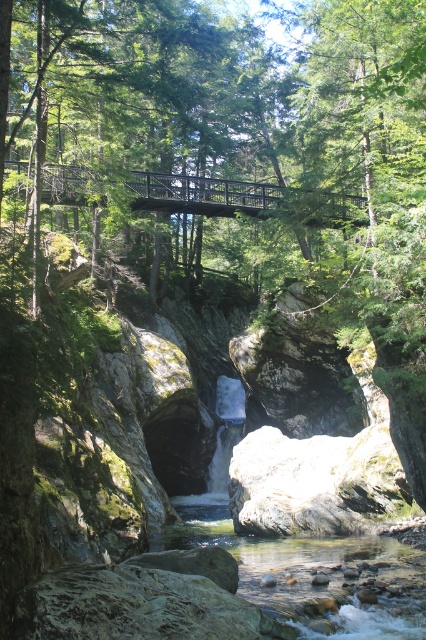
Can you confirm if clear smooth rock at center is positioned below black metal bridge at center?

Correct, clear smooth rock at center is located below black metal bridge at center.

Is clear smooth rock at center smaller than black metal bridge at center?

Yes, clear smooth rock at center is smaller than black metal bridge at center.

Does point (175, 508) come in front of point (236, 202)?

Yes.

Image resolution: width=426 pixels, height=640 pixels. Find the location of `clear smooth rock at center`. clear smooth rock at center is located at coordinates (310, 573).